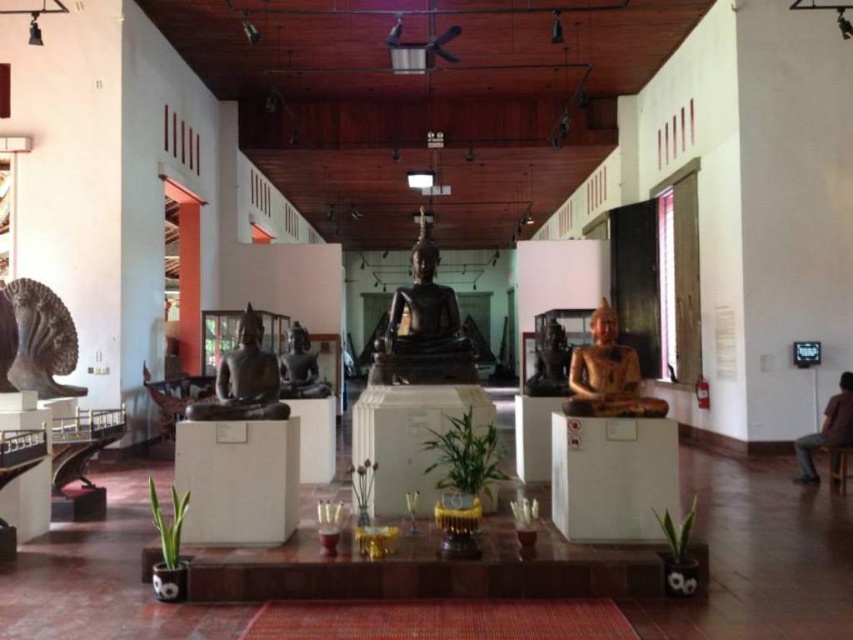
Question: Which of the following is the farthest from the observer?

Choices:
 (A) (564, 333)
 (B) (601, 376)
 (C) (32, 371)

Answer: (A)

Question: Is black stone sculpture at left positioned at the back of matte black statue at center?

Choices:
 (A) no
 (B) yes

Answer: (A)

Question: Is the position of gold polished statue at right less distant than that of matte black statue at left?

Choices:
 (A) yes
 (B) no

Answer: (A)

Question: Among these objects, which one is farthest from the camera?

Choices:
 (A) gold polished statue at center
 (B) black polished statue at center
 (C) black stone sculpture at left

Answer: (A)

Question: Does brown leather chair at lower right lie behind gold polished statue at center?

Choices:
 (A) no
 (B) yes

Answer: (B)

Question: Estimate the real-world distances between objects in this image. Which object is farther from the black polished statue at center?

Choices:
 (A) black stone sculpture at left
 (B) gold polished statue at center
 (C) gold polished statue at right

Answer: (B)